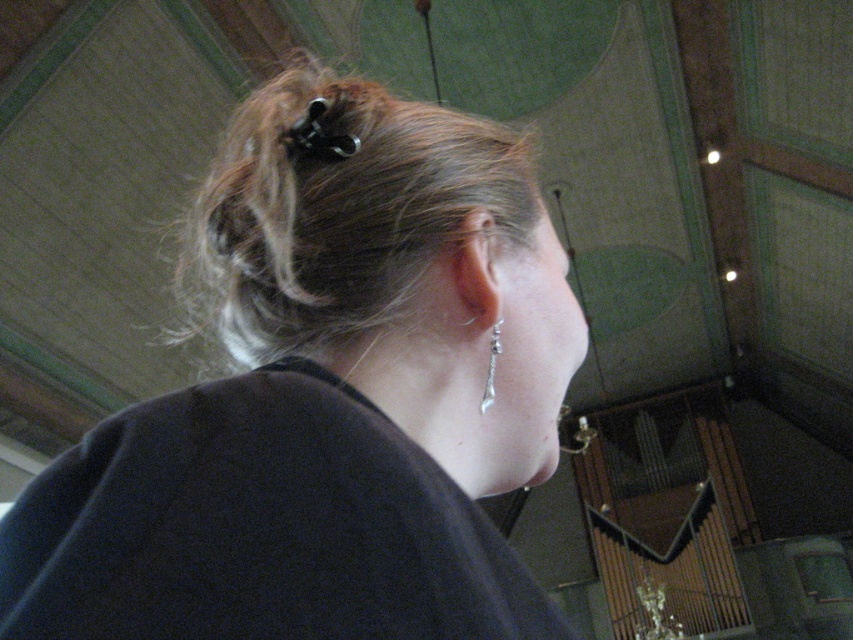
Who is lower down, matte black hair at center or blonde hair at upper center?

blonde hair at upper center

Between matte black hair at center and blonde hair at upper center, which one has less height?

matte black hair at center is shorter.

I want to click on matte black hair at center, so click(326, 396).

Is matte black hair at center behind silver metallic earring at ear?

Yes, matte black hair at center is behind silver metallic earring at ear.

Is point (112, 468) more distant than point (488, 392)?

That is False.

Is point (286, 424) farther from camera compared to point (489, 365)?

That is False.

At what (x,y) coordinates should I click in order to perform the action: click on matte black hair at center. Please return your answer as a coordinate pair (x, y). The height and width of the screenshot is (640, 853). Looking at the image, I should click on (326, 396).

Is blonde hair at upper center smaller than silver metallic earring at ear?

No, blonde hair at upper center is not smaller than silver metallic earring at ear.

Is blonde hair at upper center further to the viewer compared to silver metallic earring at ear?

That is True.

What do you see at coordinates (335, 209) in the screenshot? I see `blonde hair at upper center` at bounding box center [335, 209].

In order to click on blonde hair at upper center in this screenshot , I will do `click(335, 209)`.